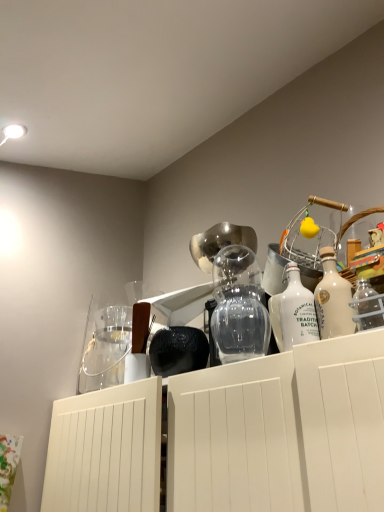
Question: Are white glass bottle at center, which ranks as the 2th bottle in right-to-left order, and white glass bottle at upper right, the 1th bottle from the right, far apart?

Choices:
 (A) no
 (B) yes

Answer: (A)

Question: Does white glass bottle at center, which ranks as the 2th bottle in right-to-left order, appear on the left side of white glass bottle at upper right, marked as the 2th bottle in a left-to-right arrangement?

Choices:
 (A) no
 (B) yes

Answer: (B)

Question: Can you confirm if white glass bottle at center, arranged as the first bottle when viewed from the left, is taller than white glass bottle at upper right, marked as the 2th bottle in a left-to-right arrangement?

Choices:
 (A) yes
 (B) no

Answer: (B)

Question: From a real-world perspective, is white glass bottle at center, which ranks as the 2th bottle in right-to-left order, on white glass bottle at upper right, marked as the 2th bottle in a left-to-right arrangement?

Choices:
 (A) yes
 (B) no

Answer: (B)

Question: From a real-world perspective, does white glass bottle at center, arranged as the first bottle when viewed from the left, sit lower than white glass bottle at upper right, marked as the 2th bottle in a left-to-right arrangement?

Choices:
 (A) yes
 (B) no

Answer: (A)

Question: Considering the relative sizes of white glass bottle at center, which ranks as the 2th bottle in right-to-left order, and white glass bottle at upper right, marked as the 2th bottle in a left-to-right arrangement, in the image provided, is white glass bottle at center, which ranks as the 2th bottle in right-to-left order, smaller than white glass bottle at upper right, marked as the 2th bottle in a left-to-right arrangement,?

Choices:
 (A) no
 (B) yes

Answer: (B)

Question: Is clear glass jar at upper left wider than white glass bottle at center, arranged as the first bottle when viewed from the left?

Choices:
 (A) no
 (B) yes

Answer: (B)

Question: From a real-world perspective, is clear glass jar at upper left physically above white glass bottle at center, arranged as the first bottle when viewed from the left?

Choices:
 (A) no
 (B) yes

Answer: (B)

Question: Is clear glass jar at upper left next to white glass bottle at center, arranged as the first bottle when viewed from the left?

Choices:
 (A) yes
 (B) no

Answer: (B)

Question: Considering the relative positions of clear glass jar at upper left and white glass bottle at center, which ranks as the 2th bottle in right-to-left order, in the image provided, is clear glass jar at upper left to the right of white glass bottle at center, which ranks as the 2th bottle in right-to-left order, from the viewer's perspective?

Choices:
 (A) yes
 (B) no

Answer: (B)

Question: From a real-world perspective, is clear glass jar at upper left positioned under white glass bottle at center, which ranks as the 2th bottle in right-to-left order, based on gravity?

Choices:
 (A) yes
 (B) no

Answer: (B)

Question: From the image's perspective, is clear glass jar at upper left above white glass bottle at center, which ranks as the 2th bottle in right-to-left order?

Choices:
 (A) no
 (B) yes

Answer: (A)

Question: From a real-world perspective, is white glass bottle at center, arranged as the first bottle when viewed from the left, located higher than transparent glass vase at center?

Choices:
 (A) no
 (B) yes

Answer: (A)